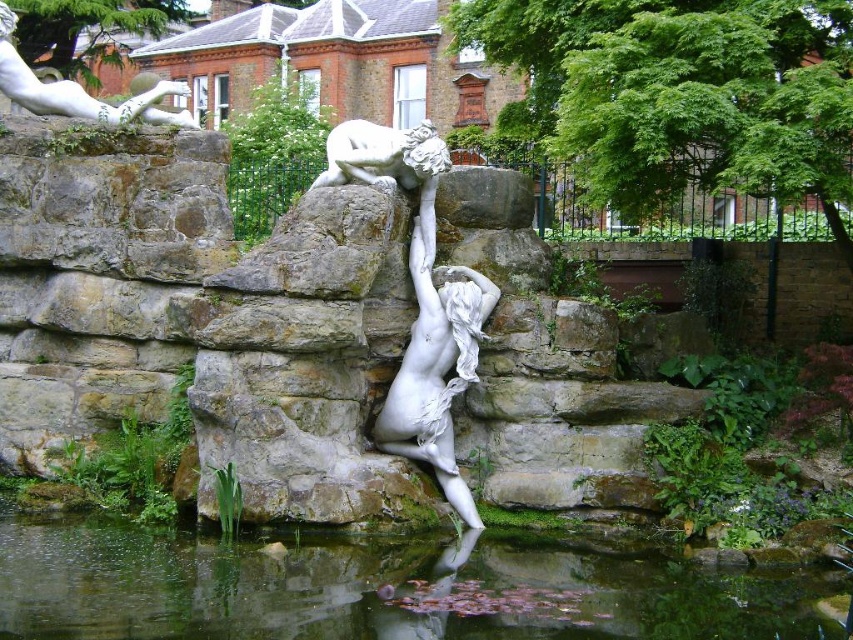
Question: In this image, where is clear water at pond center located relative to white marble statue at upper left?

Choices:
 (A) above
 (B) below

Answer: (B)

Question: Can you confirm if clear water at pond center is thinner than white marble statue at upper left?

Choices:
 (A) no
 (B) yes

Answer: (B)

Question: Which point is closer to the camera taking this photo?

Choices:
 (A) (192, 552)
 (B) (39, 96)

Answer: (A)

Question: Which point is farther to the camera?

Choices:
 (A) white marble statue at upper left
 (B) clear water at pond center

Answer: (A)

Question: Does clear water at pond center appear over white marble statue at upper left?

Choices:
 (A) no
 (B) yes

Answer: (A)